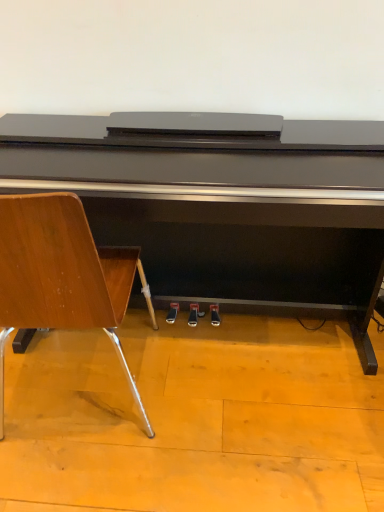
At what (x,y) coordinates should I click in order to perform the action: click on vacant location below wooden chair at left (from a real-world perspective). Please return your answer as a coordinate pair (x, y). This screenshot has height=512, width=384. Looking at the image, I should click on (86, 386).